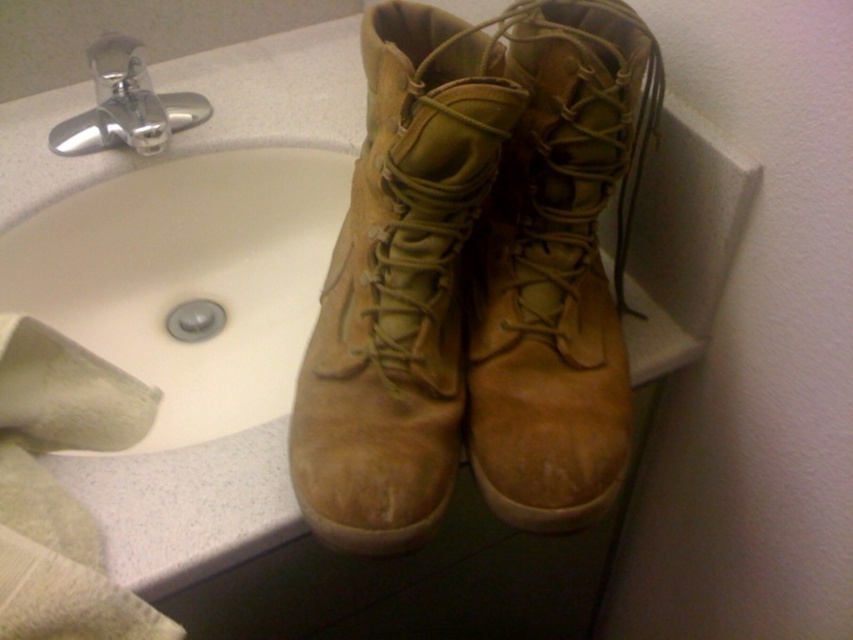
Question: Is tan suede boot at upper right thinner than silver metallic faucet at upper left?

Choices:
 (A) no
 (B) yes

Answer: (B)

Question: Which of the following is the closest to the observer?

Choices:
 (A) (393, 289)
 (B) (157, 132)
 (C) (546, 429)

Answer: (C)

Question: Which point is closer to the camera?

Choices:
 (A) tan suede boot at center
 (B) silver metallic faucet at upper left
 (C) tan suede boot at upper right

Answer: (A)

Question: Where is tan suede boot at center located in relation to silver metallic faucet at upper left in the image?

Choices:
 (A) above
 (B) below

Answer: (B)

Question: Considering the relative positions of tan suede boot at center and silver metallic faucet at upper left in the image provided, where is tan suede boot at center located with respect to silver metallic faucet at upper left?

Choices:
 (A) left
 (B) right

Answer: (B)

Question: Which point appears farthest from the camera in this image?

Choices:
 (A) (207, 109)
 (B) (577, 161)
 (C) (401, 106)

Answer: (A)